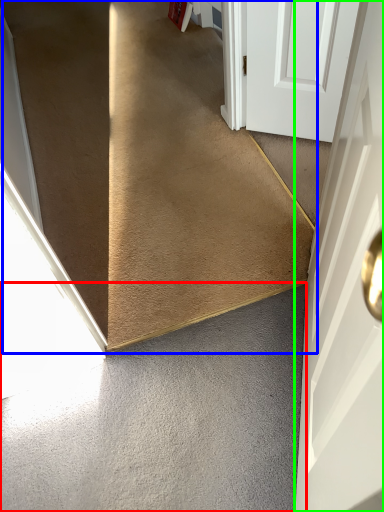
Question: Based on their relative distances, which object is nearer to concrete (highlighted by a red box)? Choose from stairs (highlighted by a blue box) and door (highlighted by a green box).

Choices:
 (A) stairs
 (B) door

Answer: (B)